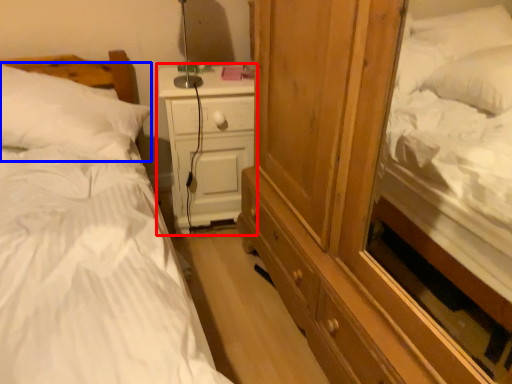
Question: Among these objects, which one is farthest to the camera, nightstand (highlighted by a red box) or pillow (highlighted by a blue box)?

Choices:
 (A) nightstand
 (B) pillow

Answer: (A)